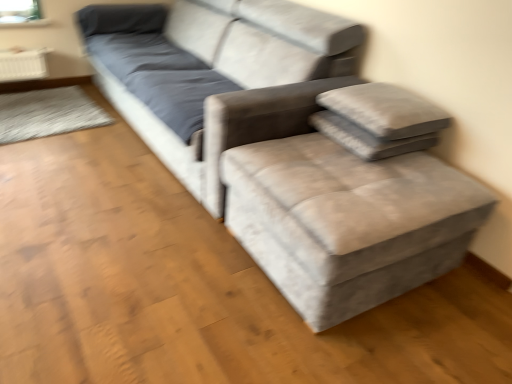
Question: Considering the relative sizes of gray fabric pillow at upper right, which appears as the first pillow when ordered from the bottom, and textured gray pillow at upper right, the second pillow positioned from the bottom, in the image provided, is gray fabric pillow at upper right, which appears as the first pillow when ordered from the bottom, taller than textured gray pillow at upper right, the second pillow positioned from the bottom,?

Choices:
 (A) yes
 (B) no

Answer: (B)

Question: Considering the relative sizes of gray fabric pillow at upper right, which is counted as the 2th pillow, starting from the top, and textured gray pillow at upper right, which ranks as the first pillow in top-to-bottom order, in the image provided, is gray fabric pillow at upper right, which is counted as the 2th pillow, starting from the top, thinner than textured gray pillow at upper right, which ranks as the first pillow in top-to-bottom order,?

Choices:
 (A) yes
 (B) no

Answer: (A)

Question: Is gray fabric pillow at upper right, which appears as the first pillow when ordered from the bottom, smaller than textured gray pillow at upper right, which ranks as the first pillow in top-to-bottom order?

Choices:
 (A) yes
 (B) no

Answer: (A)

Question: From a real-world perspective, is gray fabric pillow at upper right, which appears as the first pillow when ordered from the bottom, physically above textured gray pillow at upper right, which ranks as the first pillow in top-to-bottom order?

Choices:
 (A) no
 (B) yes

Answer: (A)

Question: Is gray fabric pillow at upper right, which appears as the first pillow when ordered from the bottom, shorter than textured gray pillow at upper right, the second pillow positioned from the bottom?

Choices:
 (A) yes
 (B) no

Answer: (A)

Question: Based on their sizes in the image, would you say textured gray pillow at upper right, which ranks as the first pillow in top-to-bottom order, is bigger or smaller than velvet grey couch at center?

Choices:
 (A) big
 (B) small

Answer: (B)

Question: From their relative heights in the image, would you say textured gray pillow at upper right, which ranks as the first pillow in top-to-bottom order, is taller or shorter than velvet grey couch at center?

Choices:
 (A) short
 (B) tall

Answer: (A)

Question: From a real-world perspective, is textured gray pillow at upper right, which ranks as the first pillow in top-to-bottom order, above or below velvet grey couch at center?

Choices:
 (A) above
 (B) below

Answer: (A)

Question: Considering the relative positions of textured gray pillow at upper right, the second pillow positioned from the bottom, and velvet grey couch at center in the image provided, is textured gray pillow at upper right, the second pillow positioned from the bottom, to the left or to the right of velvet grey couch at center?

Choices:
 (A) left
 (B) right

Answer: (B)

Question: From their relative heights in the image, would you say velvet grey couch at center is taller or shorter than textured gray pillow at upper right, the second pillow positioned from the bottom?

Choices:
 (A) short
 (B) tall

Answer: (B)

Question: Is velvet grey couch at center wider or thinner than textured gray pillow at upper right, the second pillow positioned from the bottom?

Choices:
 (A) wide
 (B) thin

Answer: (A)

Question: In terms of size, does velvet grey couch at center appear bigger or smaller than textured gray pillow at upper right, the second pillow positioned from the bottom?

Choices:
 (A) big
 (B) small

Answer: (A)

Question: Is velvet grey couch at center spatially inside textured gray pillow at upper right, which ranks as the first pillow in top-to-bottom order, or outside of it?

Choices:
 (A) inside
 (B) outside

Answer: (B)

Question: Is gray fabric pillow at upper right, which appears as the first pillow when ordered from the bottom, inside or outside of velvet grey couch at center?

Choices:
 (A) outside
 (B) inside

Answer: (A)

Question: Based on their positions, is gray fabric pillow at upper right, which is counted as the 2th pillow, starting from the top, located to the left or right of velvet grey couch at center?

Choices:
 (A) left
 (B) right

Answer: (B)